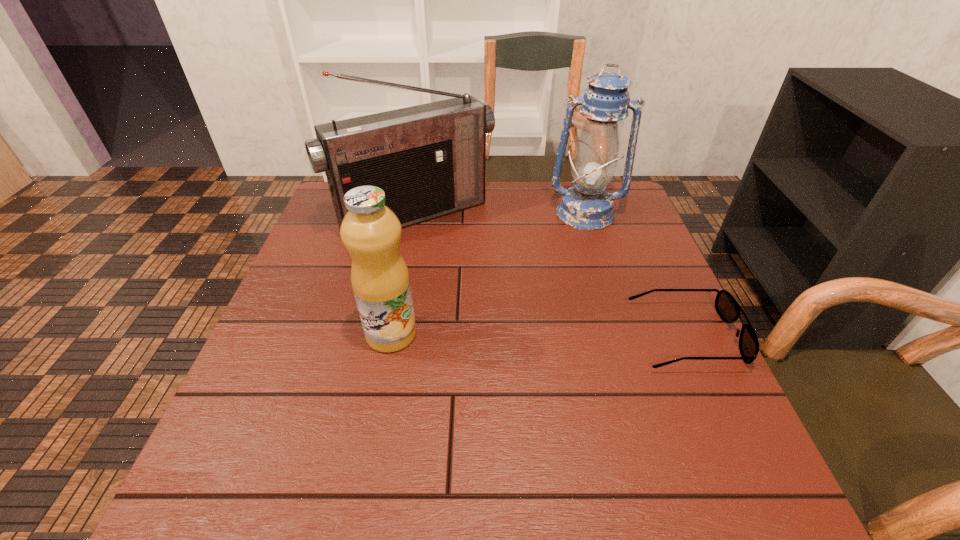
In the image, there is a desktop. Identify the location of free space at the right edge. This screenshot has height=540, width=960. (678, 306).

Locate an element on the screen. Image resolution: width=960 pixels, height=540 pixels. free spot at the near left corner of the desktop is located at coordinates (265, 434).

Find the location of a particular element. vacant area at the far right corner of the desktop is located at coordinates (617, 189).

The image size is (960, 540). What are the coordinates of `free space that is in between the fruit juice and the shortest object` in the screenshot? It's located at (539, 335).

Where is `unoccupied area between the radio receiver and the lantern`? The width and height of the screenshot is (960, 540). unoccupied area between the radio receiver and the lantern is located at coordinates (500, 214).

Identify the location of vacant space that's between the lantern and the radio receiver. (500, 214).

You are a GUI agent. You are given a task and a screenshot of the screen. Output one action in this format:
    pyautogui.click(x=<x>, y=<y>)
    Task: Click on the vacant area between the shortest object and the lantern
    
    Given the screenshot: What is the action you would take?
    pyautogui.click(x=636, y=275)

Where is `vacant space in between the lantern and the spectacles`? The image size is (960, 540). vacant space in between the lantern and the spectacles is located at coordinates (636, 275).

In order to click on empty location between the radio receiver and the lantern in this screenshot , I will do `click(500, 214)`.

Where is `free point between the spectacles and the second shortest object`? free point between the spectacles and the second shortest object is located at coordinates pos(539,335).